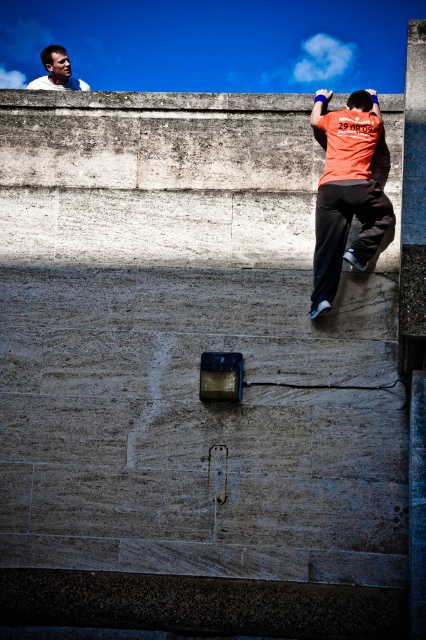
Question: Which point is farther to the camera?

Choices:
 (A) (342, 164)
 (B) (40, 84)

Answer: (B)

Question: Observing the image, what is the correct spatial positioning of orange matte shirt at upper right in reference to white shirt at upper left?

Choices:
 (A) below
 (B) above

Answer: (A)

Question: Which of the following is the closest to the observer?

Choices:
 (A) orange matte shirt at upper right
 (B) white shirt at upper left

Answer: (A)

Question: Can you confirm if orange matte shirt at upper right is wider than white shirt at upper left?

Choices:
 (A) no
 (B) yes

Answer: (A)

Question: Is orange matte shirt at upper right further to the viewer compared to white shirt at upper left?

Choices:
 (A) no
 (B) yes

Answer: (A)